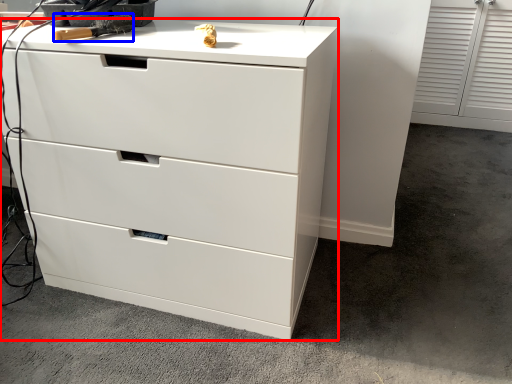
Question: Among these objects, which one is nearest to the camera, chest of drawers (highlighted by a red box) or tool (highlighted by a blue box)?

Choices:
 (A) chest of drawers
 (B) tool

Answer: (A)